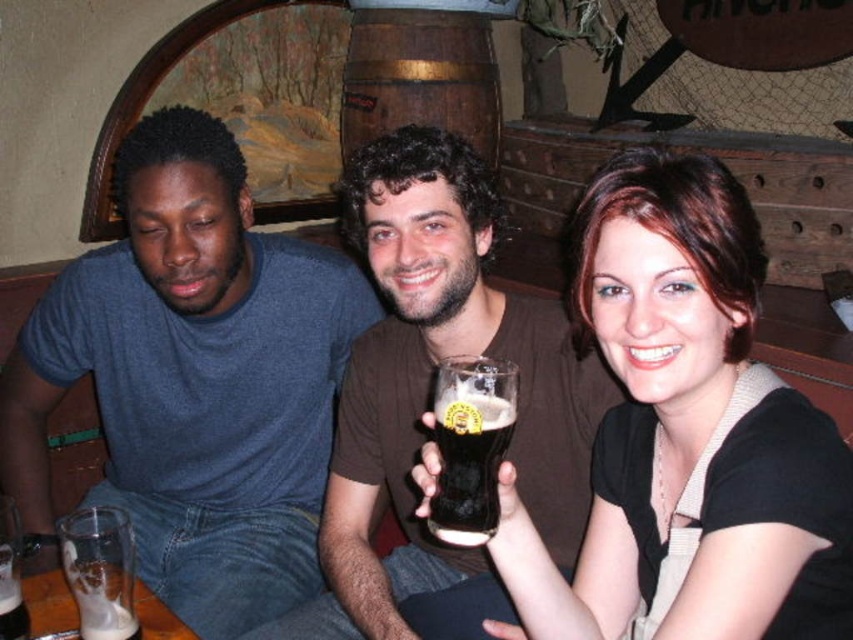
Can you confirm if dark brown glass at center is smaller than translucent glass mug at lower left?

Correct, dark brown glass at center occupies less space than translucent glass mug at lower left.

Is point (465, 417) closer to camera compared to point (131, 554)?

Yes, point (465, 417) is in front of point (131, 554).

This screenshot has width=853, height=640. Identify the location of dark brown glass at center. (469, 445).

Between brown matte shirt at center and dark brown glass at center, which one appears on the right side from the viewer's perspective?

dark brown glass at center is more to the right.

Is point (537, 406) farther from viewer compared to point (451, 436)?

Yes, it is.

Where is `brown matte shirt at center`? Image resolution: width=853 pixels, height=640 pixels. brown matte shirt at center is located at coordinates (431, 385).

Is matte blue shirt at left positioned before dark brown glass at center?

That is False.

Which is behind, point (74, 348) or point (480, 458)?

The point (74, 348) is more distant.

Locate an element on the screen. This screenshot has width=853, height=640. matte blue shirt at left is located at coordinates (194, 380).